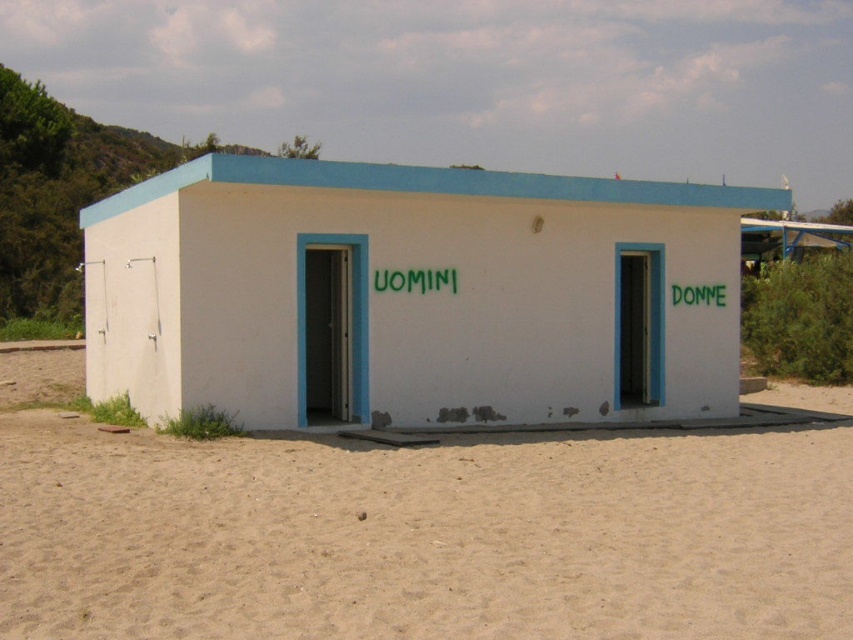
Question: Among these objects, which one is nearest to the camera?

Choices:
 (A) beige sand at lower center
 (B) white matte building at center

Answer: (A)

Question: Does beige sand at lower center appear on the left side of white matte building at center?

Choices:
 (A) yes
 (B) no

Answer: (B)

Question: Does beige sand at lower center come in front of white matte building at center?

Choices:
 (A) yes
 (B) no

Answer: (A)

Question: Considering the relative positions of beige sand at lower center and white matte building at center in the image provided, where is beige sand at lower center located with respect to white matte building at center?

Choices:
 (A) below
 (B) above

Answer: (A)